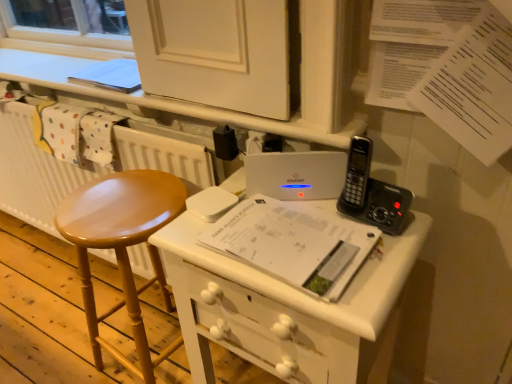
The image size is (512, 384). Find the location of `free space above white painted wood desk at center (from a real-world perspective)`. free space above white painted wood desk at center (from a real-world perspective) is located at coordinates (281, 236).